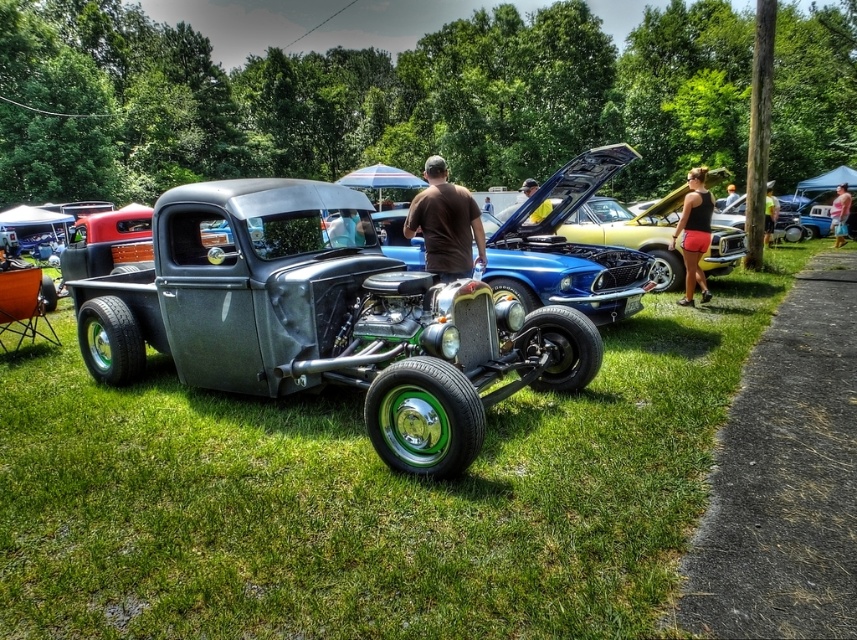
Is blue metallic car at center thinner than matte black shirt at center?

Yes.

Does blue metallic car at center appear on the right side of matte black shirt at center?

Incorrect, blue metallic car at center is not on the right side of matte black shirt at center.

Does point (580, 214) come in front of point (543, 211)?

No.

Find the location of `blue metallic car at center`. blue metallic car at center is located at coordinates (626, 236).

Locate an element on the screen. This screenshot has width=857, height=640. matte silver pickup truck at center is located at coordinates (322, 317).

Which is more to the right, matte silver pickup truck at center or blue metallic car at center?

From the viewer's perspective, blue metallic car at center appears more on the right side.

Does point (156, 216) come in front of point (577, 218)?

Yes, it is in front of point (577, 218).

Image resolution: width=857 pixels, height=640 pixels. Find the location of `matte silver pickup truck at center`. matte silver pickup truck at center is located at coordinates (322, 317).

Which of these two, matte silver pickup truck at center or black tank top at center, stands shorter?

black tank top at center

Which is below, matte silver pickup truck at center or black tank top at center?

matte silver pickup truck at center is lower down.

Who is more distant from viewer, (405, 292) or (766, 202)?

The point (766, 202) is behind.

This screenshot has height=640, width=857. Find the location of `matte silver pickup truck at center`. matte silver pickup truck at center is located at coordinates (322, 317).